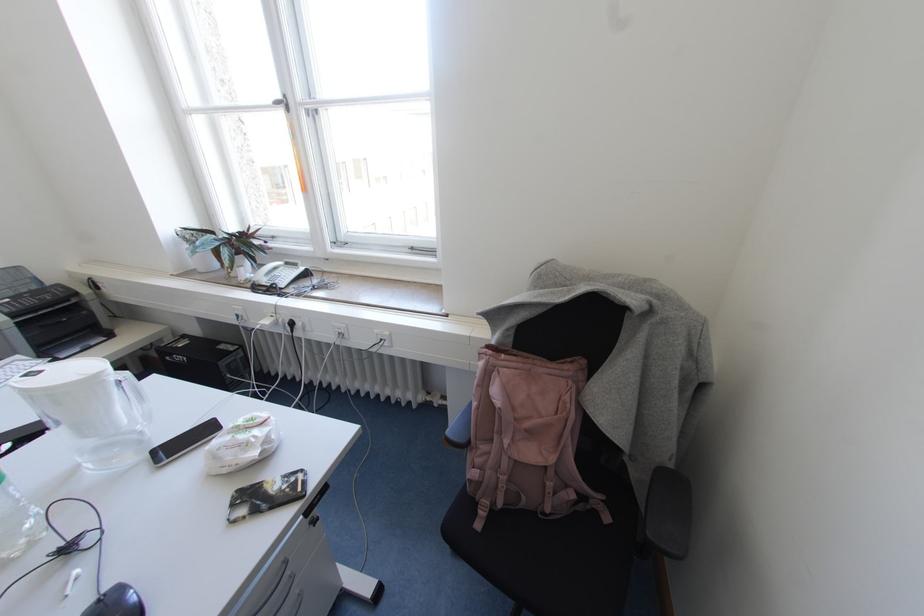
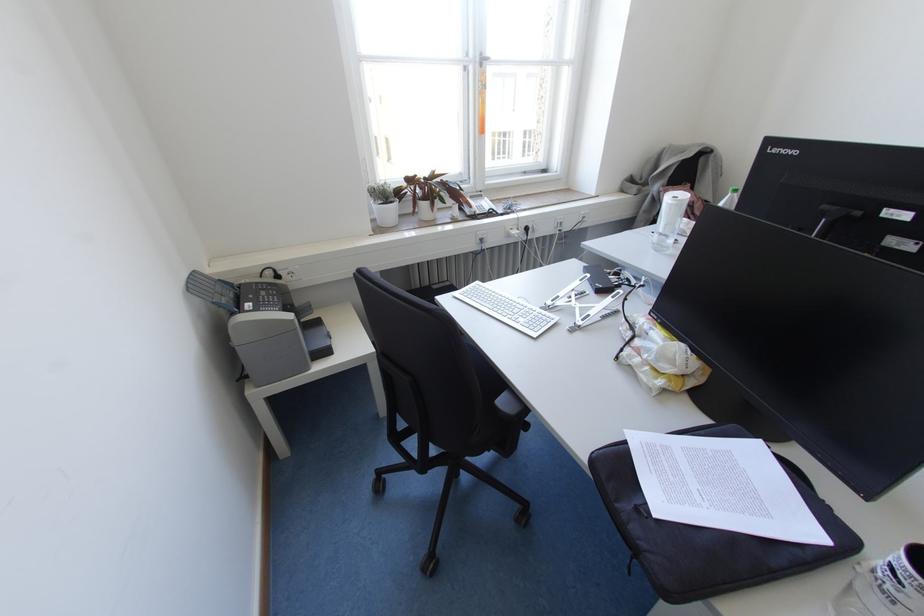
In the second image, find the point that corresponds to point 274,285 in the first image.

(490, 209)